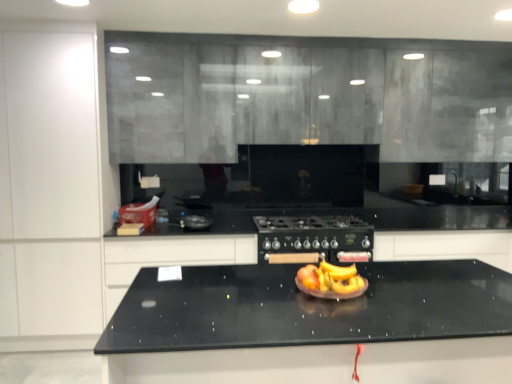
Question: Considering the relative positions of shiny plastic fruit bowl at center and white matte cabinet at left, which ranks as the 1th cabinetry in left-to-right order, in the image provided, is shiny plastic fruit bowl at center to the left of white matte cabinet at left, which ranks as the 1th cabinetry in left-to-right order, from the viewer's perspective?

Choices:
 (A) yes
 (B) no

Answer: (B)

Question: Is shiny plastic fruit bowl at center thinner than white matte cabinet at left, which ranks as the 1th cabinetry in left-to-right order?

Choices:
 (A) no
 (B) yes

Answer: (B)

Question: Does shiny plastic fruit bowl at center have a lesser height compared to white matte cabinet at left, the fourth cabinetry viewed from the right?

Choices:
 (A) no
 (B) yes

Answer: (B)

Question: Does shiny plastic fruit bowl at center have a smaller size compared to white matte cabinet at left, the fourth cabinetry viewed from the right?

Choices:
 (A) no
 (B) yes

Answer: (B)

Question: From the image's perspective, is shiny plastic fruit bowl at center below white matte cabinet at left, the fourth cabinetry viewed from the right?

Choices:
 (A) yes
 (B) no

Answer: (A)

Question: From the image's perspective, would you say shiny plastic fruit bowl at center is positioned over white matte cabinet at left, which ranks as the 1th cabinetry in left-to-right order?

Choices:
 (A) no
 (B) yes

Answer: (A)

Question: From a real-world perspective, is black matte gas stove at center located higher than matte gray cabinetry at upper center, marked as the 3th cabinetry in a left-to-right arrangement?

Choices:
 (A) yes
 (B) no

Answer: (B)

Question: Is black matte gas stove at center far away from matte gray cabinetry at upper center, marked as the 3th cabinetry in a left-to-right arrangement?

Choices:
 (A) no
 (B) yes

Answer: (A)

Question: Considering the relative sizes of black matte gas stove at center and matte gray cabinetry at upper center, marked as the 3th cabinetry in a left-to-right arrangement, in the image provided, is black matte gas stove at center shorter than matte gray cabinetry at upper center, marked as the 3th cabinetry in a left-to-right arrangement,?

Choices:
 (A) yes
 (B) no

Answer: (A)

Question: Is black matte gas stove at center in contact with matte gray cabinetry at upper center, marked as the 3th cabinetry in a left-to-right arrangement?

Choices:
 (A) no
 (B) yes

Answer: (A)

Question: Is the depth of black matte gas stove at center greater than that of matte gray cabinetry at upper center, the 2th cabinetry from the right?

Choices:
 (A) yes
 (B) no

Answer: (B)

Question: Is the position of black matte gas stove at center less distant than that of matte gray cabinetry at upper center, marked as the 3th cabinetry in a left-to-right arrangement?

Choices:
 (A) yes
 (B) no

Answer: (A)

Question: Is black matte gas stove at center facing towards black matte cabinet at center, the first cabinetry in the right-to-left sequence?

Choices:
 (A) no
 (B) yes

Answer: (A)